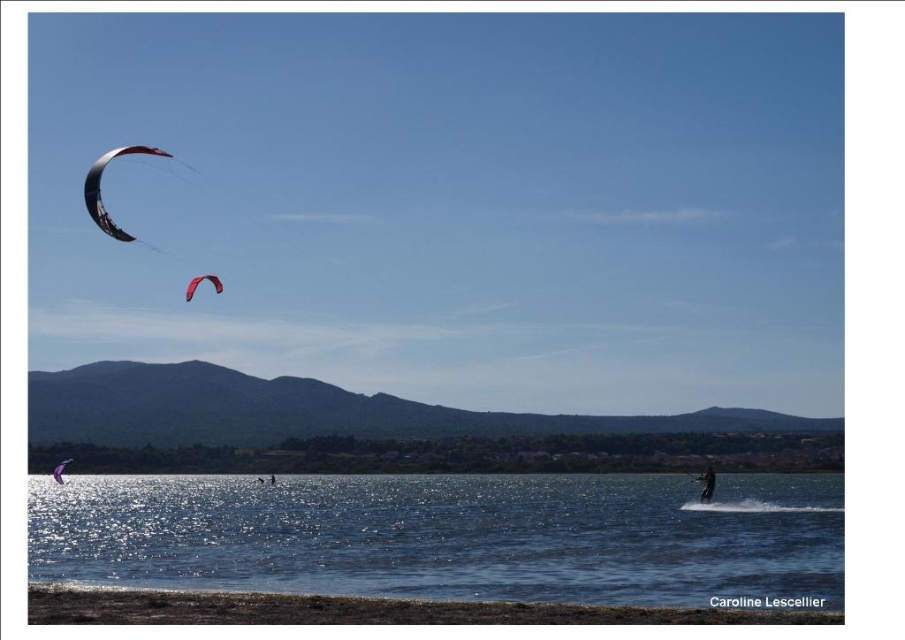
Question: Estimate the real-world distances between objects in this image. Which object is closer to the dark blue wetsuit at lower right?

Choices:
 (A) matte black parachute at upper left
 (B) clear blue water at lower center
 (C) matte black kite at upper left
 (D) red matte parachute at upper left

Answer: (D)

Question: Which object is positioned farthest from the matte black kite at upper left?

Choices:
 (A) red matte parachute at upper left
 (B) matte black parachute at upper left
 (C) clear blue water at lower center
 (D) dark blue wetsuit at lower right

Answer: (D)

Question: Is matte black parachute at upper left positioned at the back of red matte parachute at upper left?

Choices:
 (A) no
 (B) yes

Answer: (A)

Question: Can you confirm if matte black parachute at upper left is positioned to the right of matte purple kite at lower left?

Choices:
 (A) yes
 (B) no

Answer: (B)

Question: Can you confirm if clear blue water at lower center is positioned to the right of matte black kite at upper left?

Choices:
 (A) no
 (B) yes

Answer: (B)

Question: Estimate the real-world distances between objects in this image. Which object is closer to the matte black parachute at upper left?

Choices:
 (A) dark blue wetsuit at lower right
 (B) matte purple kite at lower left

Answer: (B)